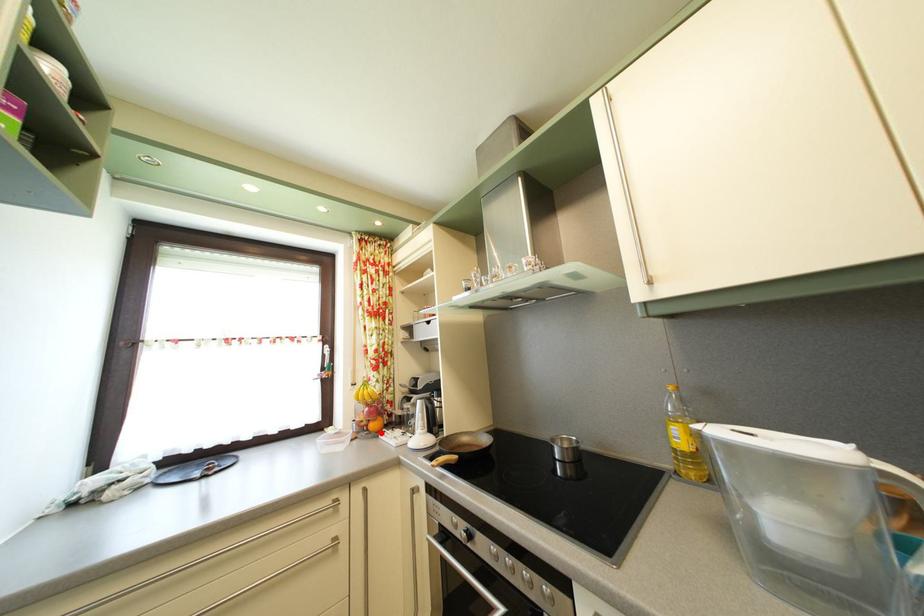
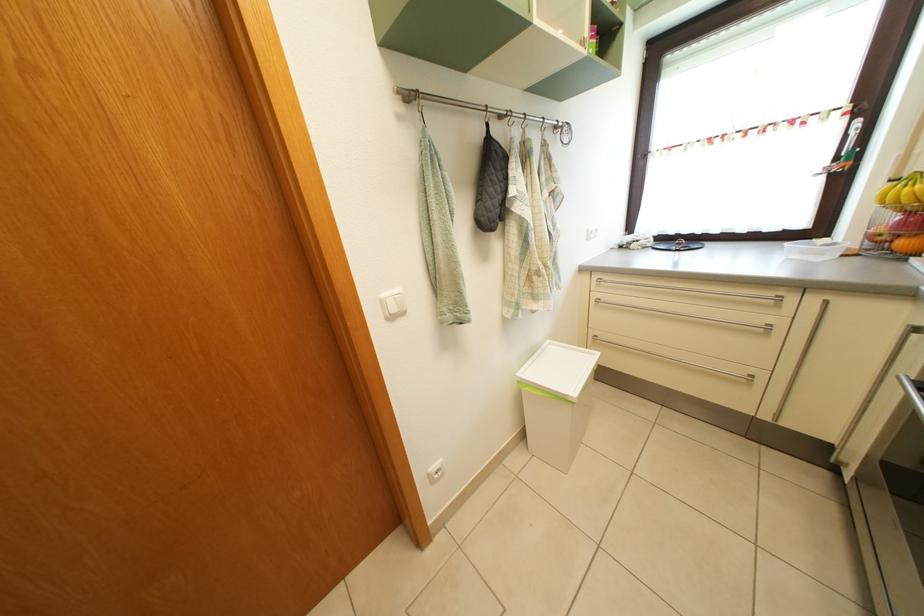
Find the pixel in the second image that matches the highlighted location in the first image.

(910, 252)